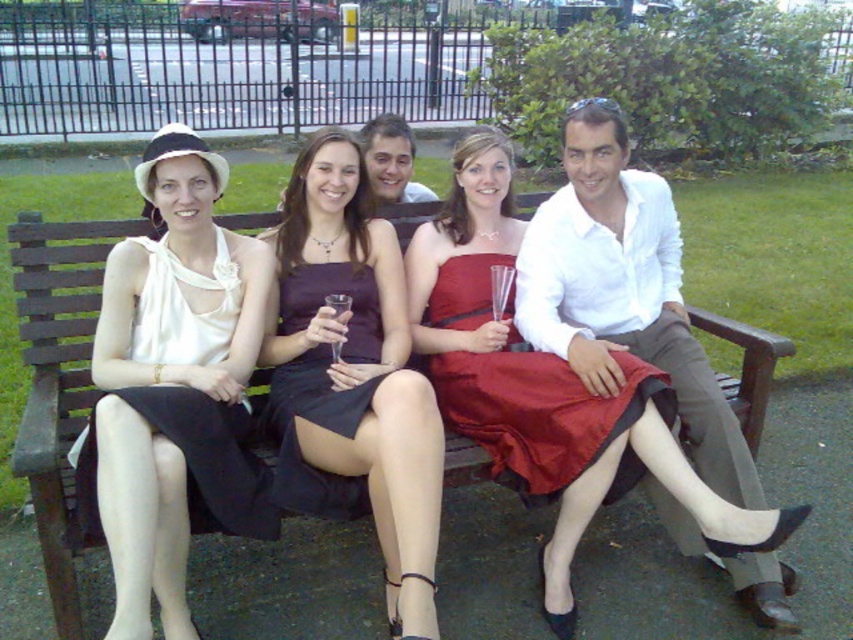
You are a photographer positioned in front of the wooden bench where the white cotton shirt at center and the satin red dress at center are sitting. You need to capture a photo that includes both subjects without any obstruction. Based on their positions, which subject should you focus on first to ensure both are in frame?

The white cotton shirt at center is to the right of the satin red dress at center. To include both in the frame, focus on the satin red dress at center first as it is on the left, then adjust to ensure the white cotton shirt at center on the right is also visible.

You are a photographer setting up a camera to capture the group on the wooden bench. You need to ensure that both the white cotton shirt at center and the satin red dress at center are fully visible in the frame. Given their widths, which of the two requires more horizontal space to fit entirely in the photo?

The white cotton shirt at center requires more horizontal space because its width surpasses that of the satin red dress at center.

You are a photographer standing in front of the wooden bench in the park. You need to take a photo of both the white cotton shirt at center and the satin red dress at center. Which one should you focus on first if you want to capture both clearly in the same frame?

The white cotton shirt at center is taller than the satin red dress at center, so you should focus on the white cotton shirt at center first to ensure both are in clear view.